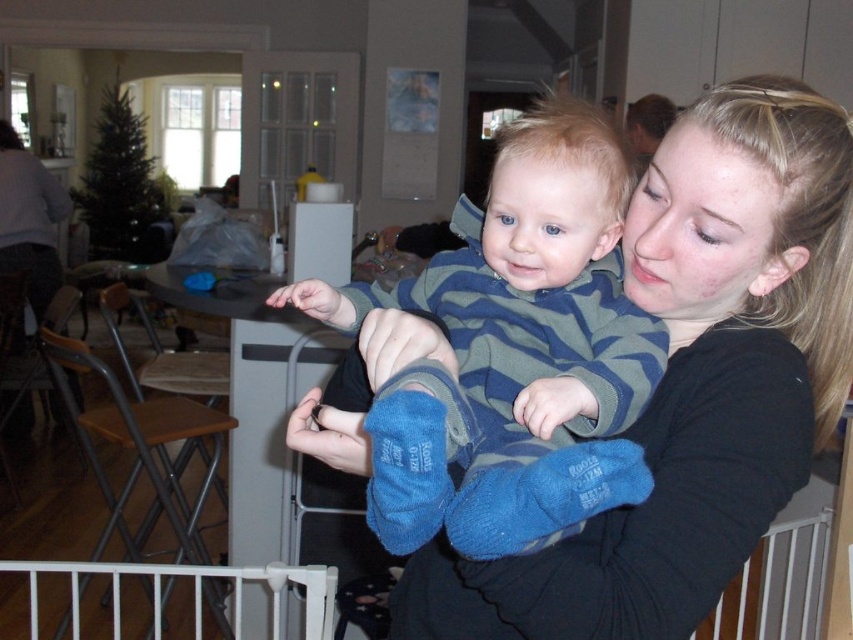
Who is more distant from viewer, (x=556, y=282) or (x=30, y=586)?

Positioned behind is point (x=30, y=586).

Is blue fleece socks at center further to camera compared to white plastic gate at lower left?

No, blue fleece socks at center is in front of white plastic gate at lower left.

Between point (436, 524) and point (113, 589), which one is positioned behind?

Point (113, 589)

Locate an element on the screen. blue fleece socks at center is located at coordinates (514, 353).

Between blue fleece socks at center and white plastic rail at lower right, which one has more height?

Standing taller between the two is white plastic rail at lower right.

Measure the distance between point (448,307) and camera.

Point (448,307) and camera are 92.85 centimeters apart.

The height and width of the screenshot is (640, 853). What are the coordinates of `blue fleece socks at center` in the screenshot? It's located at (514, 353).

Which is below, white plastic rail at lower right or white plastic gate at lower left?

white plastic rail at lower right is lower down.

Is point (746, 637) positioned after point (318, 625)?

Yes, it is.

The width and height of the screenshot is (853, 640). What do you see at coordinates (776, 584) in the screenshot?
I see `white plastic rail at lower right` at bounding box center [776, 584].

Where is `white plastic rail at lower right`? This screenshot has width=853, height=640. white plastic rail at lower right is located at coordinates (776, 584).